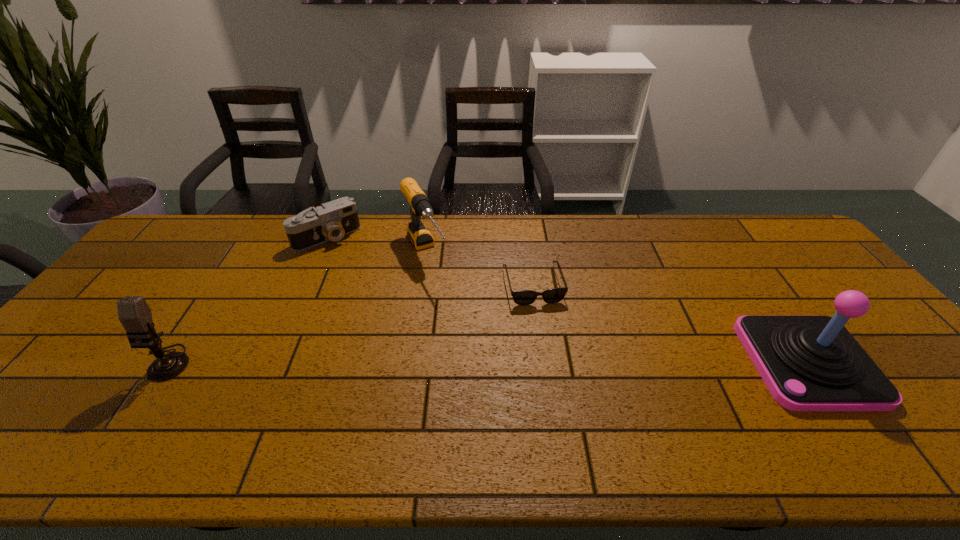
Identify the location of microphone. (134, 314).

Identify the location of the rightmost object. The width and height of the screenshot is (960, 540). (809, 363).

This screenshot has height=540, width=960. Identify the location of the second object from right to left. (522, 297).

Find the location of a particular element. the shortest object is located at coordinates (522, 297).

Image resolution: width=960 pixels, height=540 pixels. I want to click on the third object from left to right, so (420, 236).

Identify the location of camera. (333, 220).

Find the location of a particular element. the second object from left to right is located at coordinates (333, 220).

This screenshot has height=540, width=960. Find the location of `blank space located forward from the base of the joystick`. blank space located forward from the base of the joystick is located at coordinates (604, 362).

Where is `vacant space located 0.320m forward from the base of the joystick`? The width and height of the screenshot is (960, 540). vacant space located 0.320m forward from the base of the joystick is located at coordinates (624, 362).

Where is `free spot located forward from the base of the joystick`? This screenshot has height=540, width=960. free spot located forward from the base of the joystick is located at coordinates (592, 362).